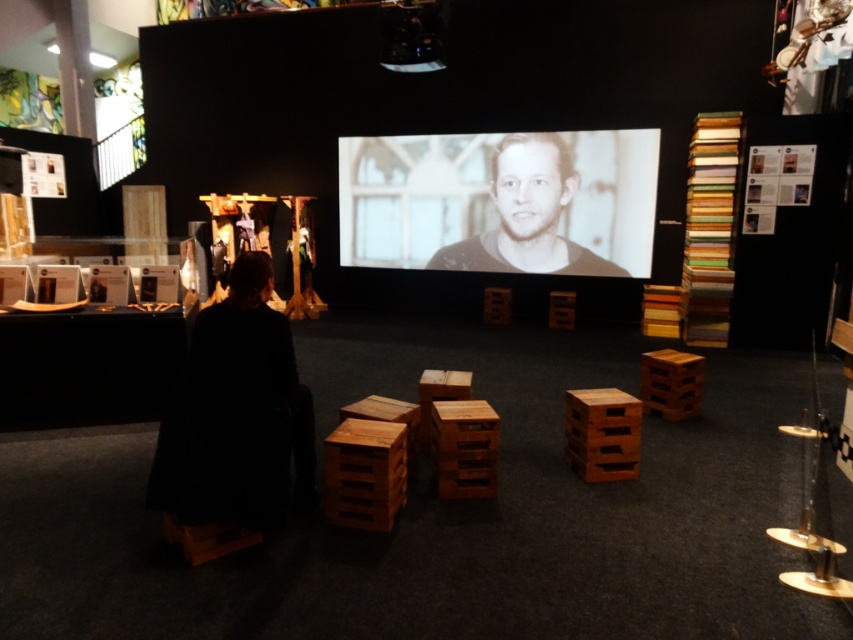
You are standing in the gallery and want to get a clear view of the black matte face at center without any obstruction. The brown wooden crate at center is in your way. Can you move around it to see the face?

The brown wooden crate at center is behind the black matte face at center, so you can see the face clearly without needing to move the crate.